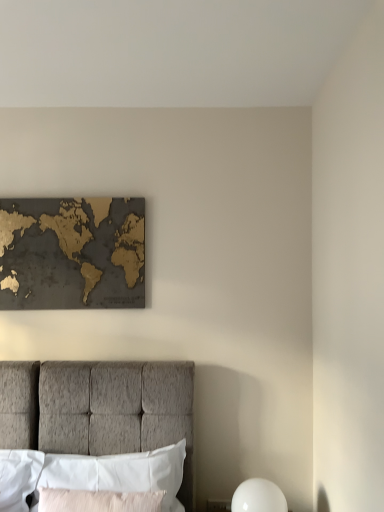
Question: Is light pink fabric pillow at lower center, positioned as the 2th pillow in back-to-front order, to the left or to the right of white fabric pillow at lower left, the 2th pillow in the front-to-back sequence, in the image?

Choices:
 (A) right
 (B) left

Answer: (B)

Question: From the image's perspective, is light pink fabric pillow at lower center, the first pillow positioned from the front, located above or below white fabric pillow at lower left, positioned as the first pillow in back-to-front order?

Choices:
 (A) above
 (B) below

Answer: (B)

Question: Based on their relative distances, which object is nearer to the light pink fabric pillow at lower center, positioned as the 2th pillow in back-to-front order?

Choices:
 (A) white glossy sphere at lower right
 (B) white fabric pillow at lower left, the 2th pillow in the front-to-back sequence
 (C) gold metallic map at upper center

Answer: (B)

Question: Which of these objects is positioned closest to the white glossy sphere at lower right?

Choices:
 (A) gold metallic map at upper center
 (B) light pink fabric pillow at lower center, the first pillow positioned from the front
 (C) white fabric pillow at lower left, the 2th pillow in the front-to-back sequence

Answer: (C)